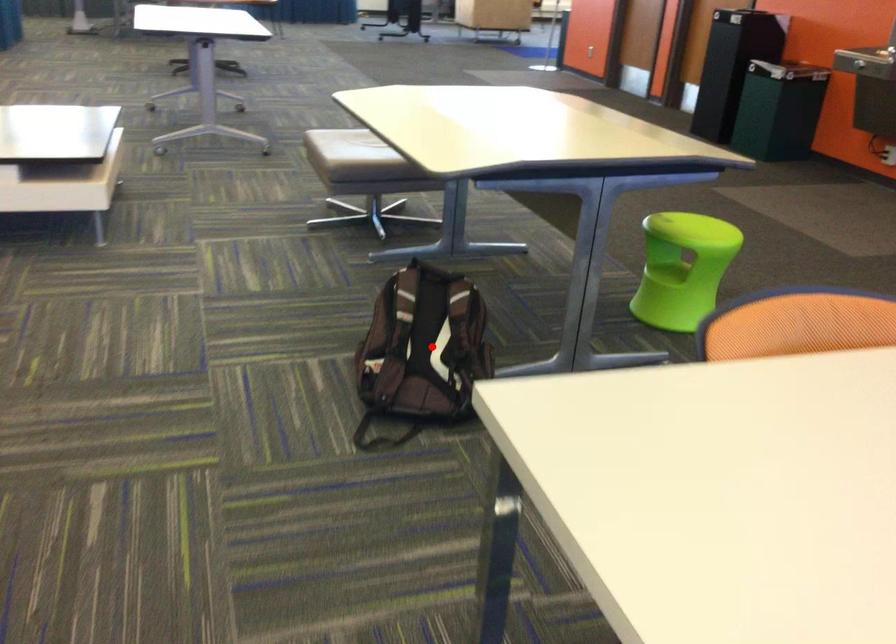
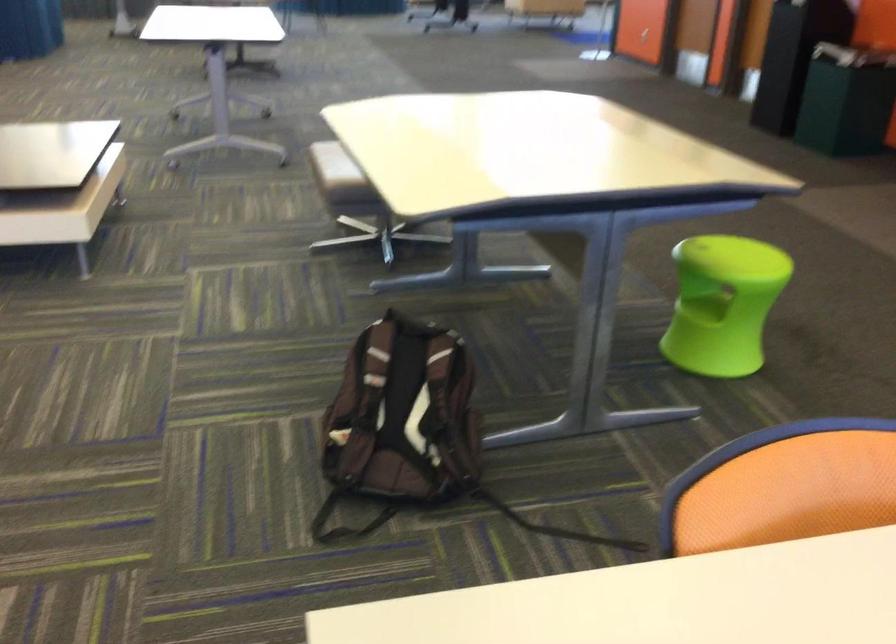
Locate, in the second image, the point that corresponds to the highlighted location in the first image.

(402, 413)